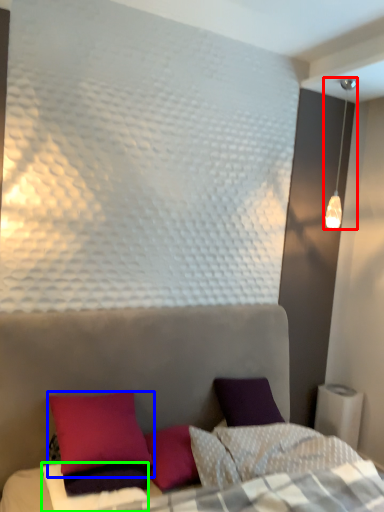
Question: Considering the real-world distances, which object is closest to lamp (highlighted by a red box)? pillow (highlighted by a blue box) or sheet (highlighted by a green box).

Choices:
 (A) pillow
 (B) sheet

Answer: (A)